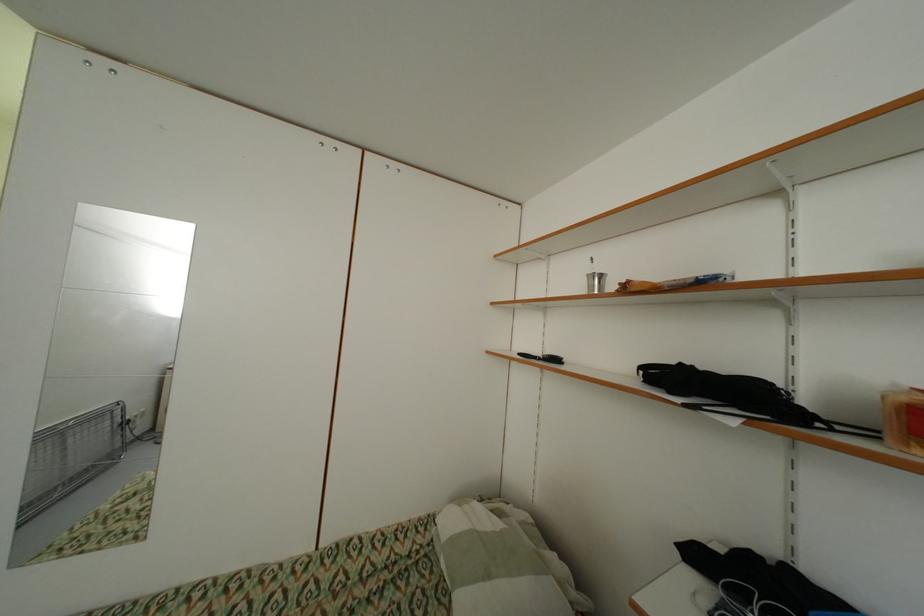
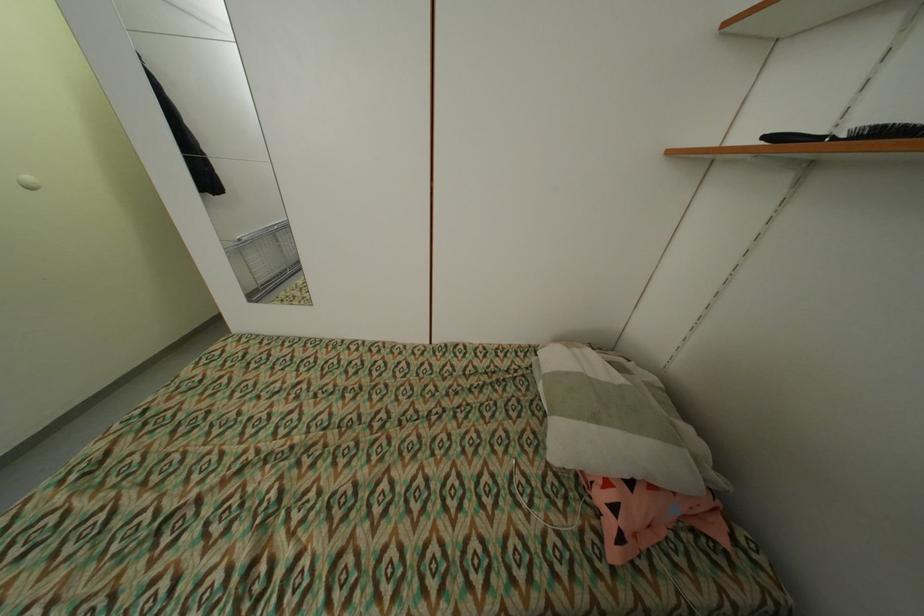
Locate, in the second image, the point that corresponds to [545,360] in the first image.

(841, 140)